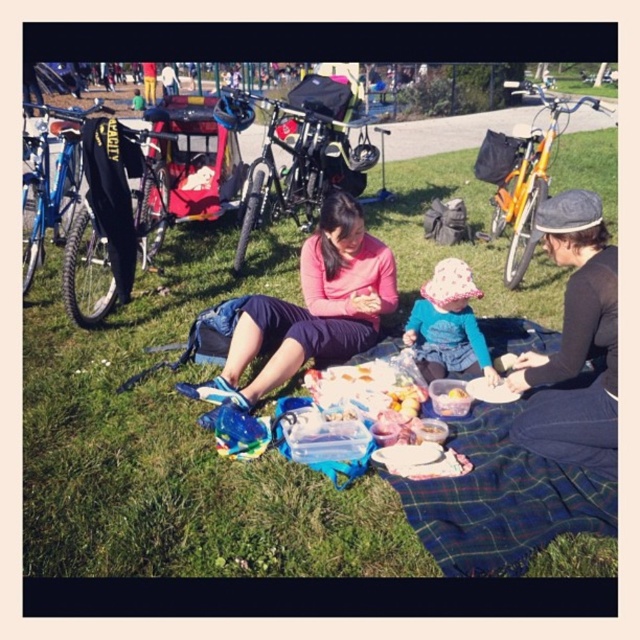
Can you confirm if orange matte bicycle at upper right is positioned to the left of fluffy pink hat at center?

Incorrect, orange matte bicycle at upper right is not on the left side of fluffy pink hat at center.

Is point (525, 259) closer to viewer compared to point (467, 324)?

No, it is not.

Between point (518, 186) and point (481, 360), which one is positioned in front?

Point (481, 360) is more forward.

This screenshot has height=640, width=640. In order to click on orange matte bicycle at upper right in this screenshot , I will do `click(522, 173)`.

Who is positioned more to the left, brushed metal bicycle at center or smooth plastic container at center?

From the viewer's perspective, brushed metal bicycle at center appears more on the left side.

Between brushed metal bicycle at center and smooth plastic container at center, which one is positioned lower?

smooth plastic container at center is lower down.

Is point (289, 138) less distant than point (374, 310)?

No, (289, 138) is further to viewer.

This screenshot has width=640, height=640. Find the location of `brushed metal bicycle at center`. brushed metal bicycle at center is located at coordinates (301, 157).

Which is below, dark gray knit hat at lower right or brushed metal bicycle at center?

dark gray knit hat at lower right

At what (x,y) coordinates should I click in order to perform the action: click on dark gray knit hat at lower right. Please return your answer as a coordinate pair (x, y). The width and height of the screenshot is (640, 640). Looking at the image, I should click on (573, 342).

Is point (520, 419) positioned after point (308, 77)?

That is False.

The image size is (640, 640). Find the location of `dark gray knit hat at lower right`. dark gray knit hat at lower right is located at coordinates (573, 342).